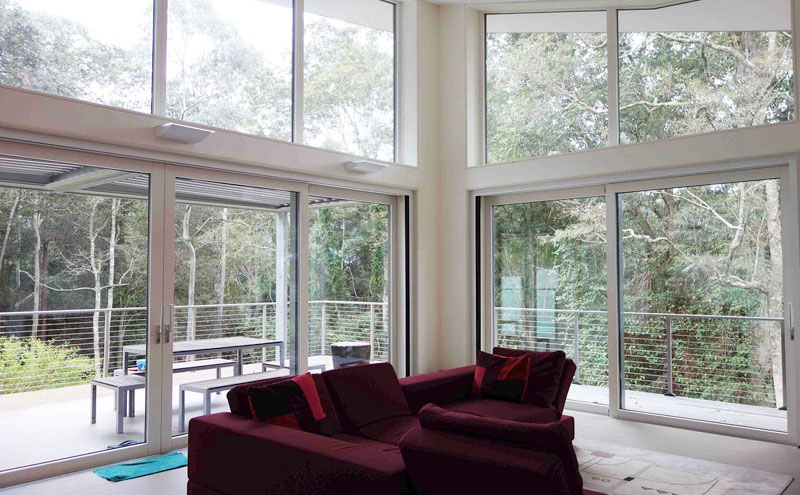
Where is `sofa`? This screenshot has height=495, width=800. sofa is located at coordinates (386, 417).